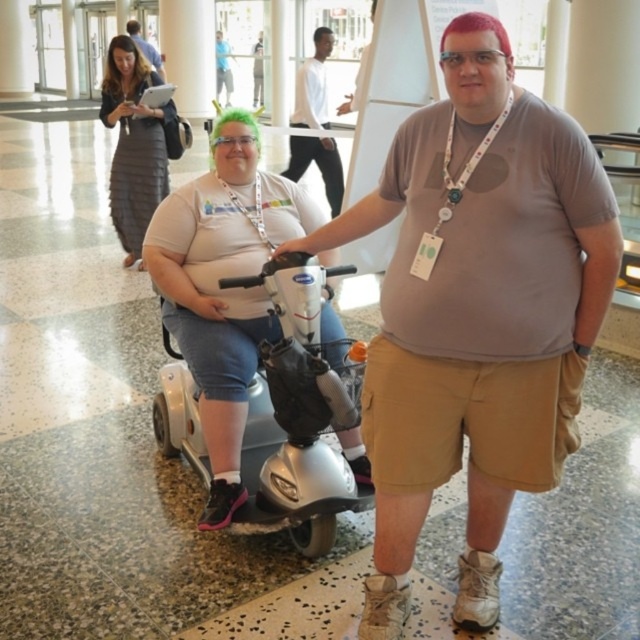
You are standing at point (145, 52) and want to walk to point (116, 88). Which direction should you move in?

You should move forward since point (116, 88) is in front of point (145, 52).

You are an assistant helping to organize a clothing display. You have two shirts in the center of the display area, a matte gray shirt at center and a white smooth shirt at center. Which shirt should you place on the lower shelf if you want to follow the rule of arranging items from shortest to tallest?

The matte gray shirt at center has a lesser height compared to the white smooth shirt at center, so you should place the matte gray shirt at center on the lower shelf.